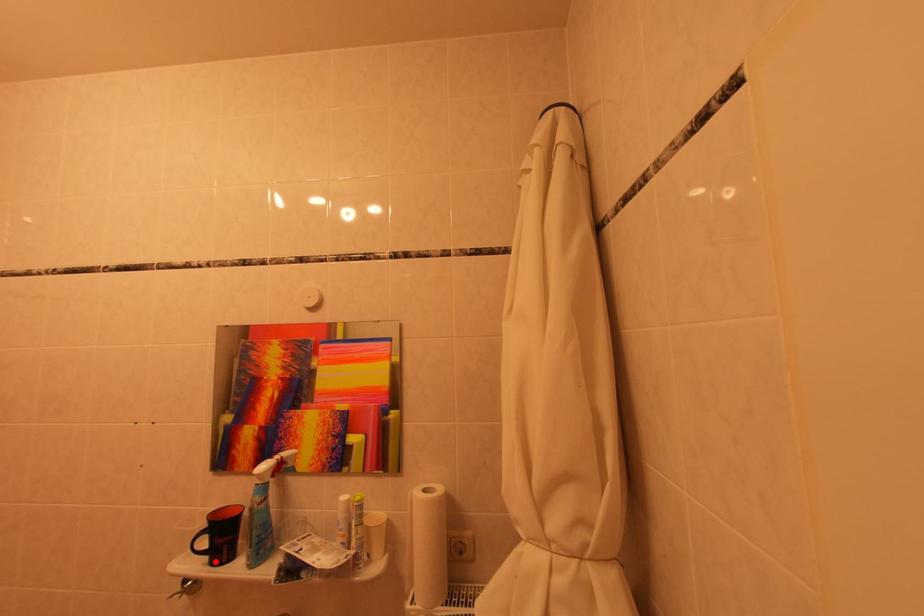
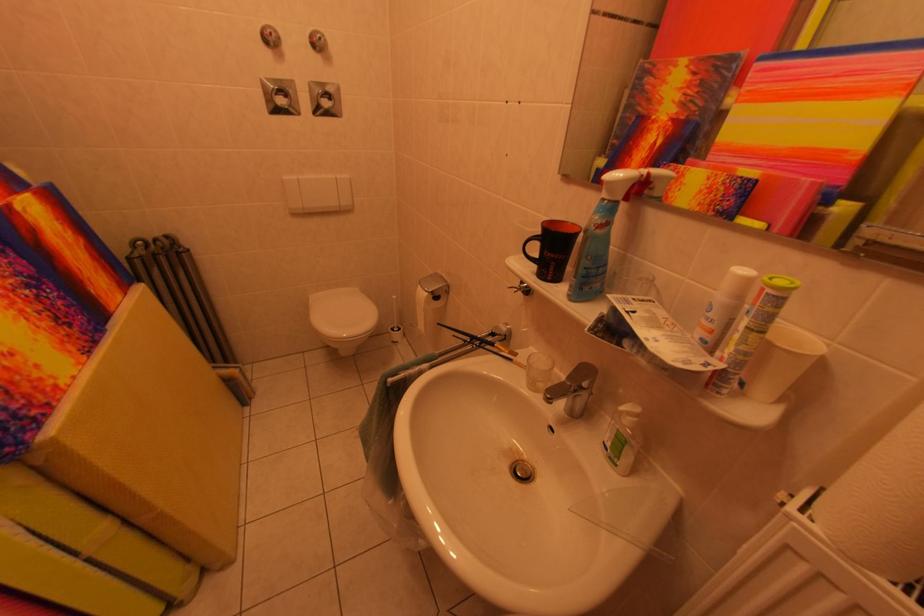
In the second image, find the point that corresponds to the highlighted location in the first image.

(543, 270)